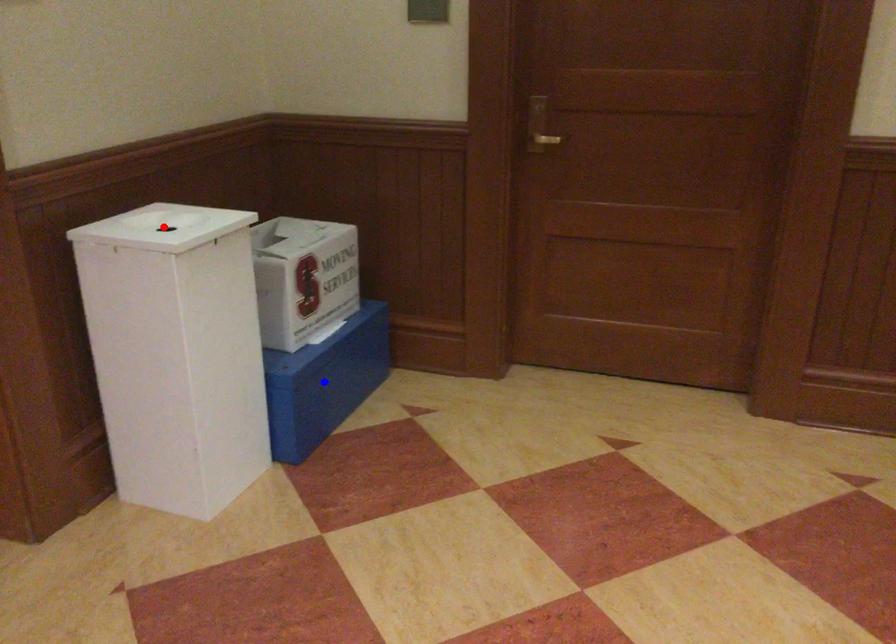
Question: Two points are marked on the image. Which point is closer to the camera?

Choices:
 (A) Blue point is closer.
 (B) Red point is closer.

Answer: (B)